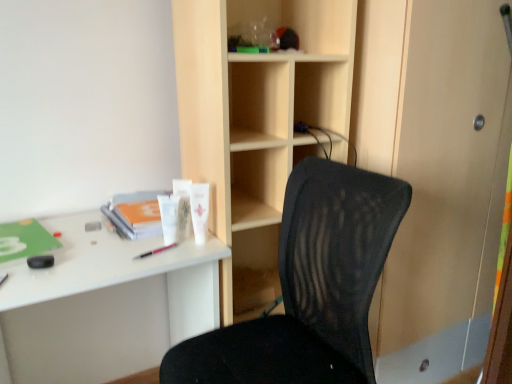
Locate an element on the screen. The image size is (512, 384). free point to the left of white matte lotion at center, the first stationery positioned from the right is located at coordinates (140, 244).